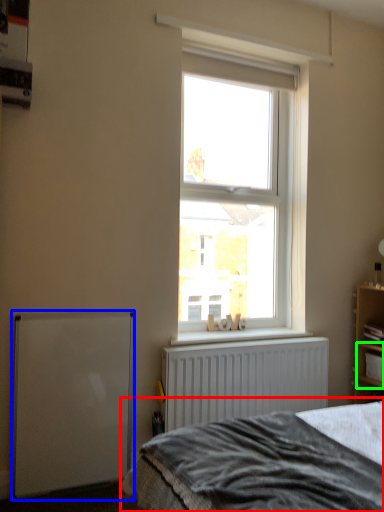
Question: Which object is the closest to the bed (highlighted by a red box)? Choose among these: wide (highlighted by a blue box) or cabinet (highlighted by a green box).

Choices:
 (A) wide
 (B) cabinet

Answer: (A)